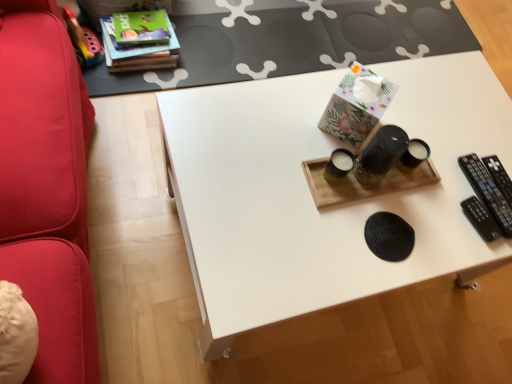
Question: Does white matte table at upper center have a smaller size compared to white matte tray at center?

Choices:
 (A) no
 (B) yes

Answer: (B)

Question: Is white matte table at upper center thinner than white matte tray at center?

Choices:
 (A) yes
 (B) no

Answer: (B)

Question: From a real-world perspective, is white matte table at upper center on white matte tray at center?

Choices:
 (A) yes
 (B) no

Answer: (B)

Question: Does white matte table at upper center come behind white matte tray at center?

Choices:
 (A) no
 (B) yes

Answer: (B)

Question: From the image's perspective, is white matte table at upper center on white matte tray at center?

Choices:
 (A) no
 (B) yes

Answer: (B)

Question: Can you confirm if white matte table at upper center is shorter than white matte tray at center?

Choices:
 (A) yes
 (B) no

Answer: (A)

Question: Is white matte tray at center facing towards hardcover book at upper left?

Choices:
 (A) no
 (B) yes

Answer: (A)

Question: Does white matte tray at center lie in front of hardcover book at upper left?

Choices:
 (A) yes
 (B) no

Answer: (A)

Question: Is white matte tray at center touching hardcover book at upper left?

Choices:
 (A) yes
 (B) no

Answer: (B)

Question: Can you confirm if white matte tray at center is shorter than hardcover book at upper left?

Choices:
 (A) no
 (B) yes

Answer: (A)

Question: Is white matte tray at center smaller than hardcover book at upper left?

Choices:
 (A) yes
 (B) no

Answer: (B)

Question: Is white matte tray at center bigger than hardcover book at upper left?

Choices:
 (A) yes
 (B) no

Answer: (A)

Question: Can you confirm if hardcover book at upper left is shorter than black plastic remote at right?

Choices:
 (A) yes
 (B) no

Answer: (B)